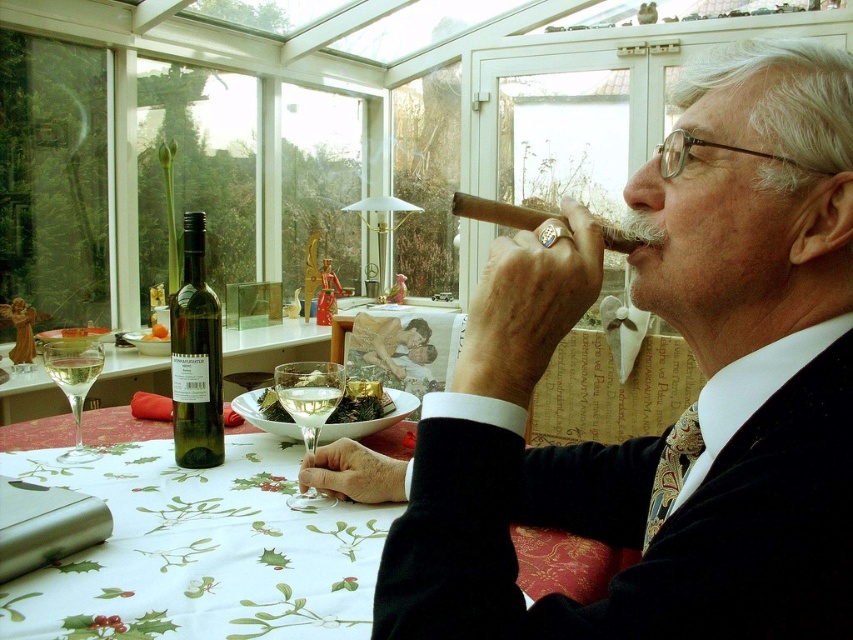
Measure the distance between green glass bottle at left and camera.

They are 85.61 centimeters apart.

Who is higher up, green glass bottle at left or clear glass wine at table left?

green glass bottle at left

Who is more forward, (216, 385) or (82, 387)?

Point (216, 385) is in front.

You are a GUI agent. You are given a task and a screenshot of the screen. Output one action in this format:
    pyautogui.click(x=<x>, y=<y>)
    Task: Click on the green glass bottle at left
    
    Given the screenshot: What is the action you would take?
    pyautogui.click(x=195, y=356)

Who is positioned more to the left, smooth brown cigar at upper right or green glass bottle at left?

green glass bottle at left is more to the left.

In the scene shown: Can you confirm if smooth brown cigar at upper right is positioned to the left of green glass bottle at left?

No, smooth brown cigar at upper right is not to the left of green glass bottle at left.

Between point (820, 131) and point (200, 300), which one is positioned in front?

Point (820, 131)

I want to click on smooth brown cigar at upper right, so click(x=688, y=406).

What do you see at coordinates (309, 396) in the screenshot? I see `clear glass wine glass at center` at bounding box center [309, 396].

How much distance is there between clear glass wine glass at center and clear glass wine at table left?

clear glass wine glass at center and clear glass wine at table left are 11.17 inches apart.

Is point (332, 392) closer to camera compared to point (71, 403)?

Yes.

I want to click on clear glass wine glass at center, so click(x=309, y=396).